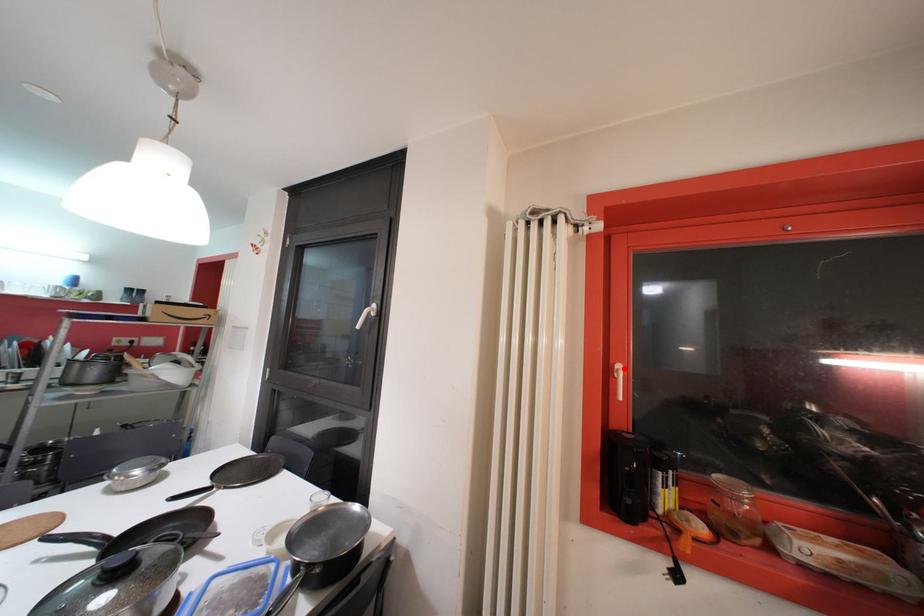
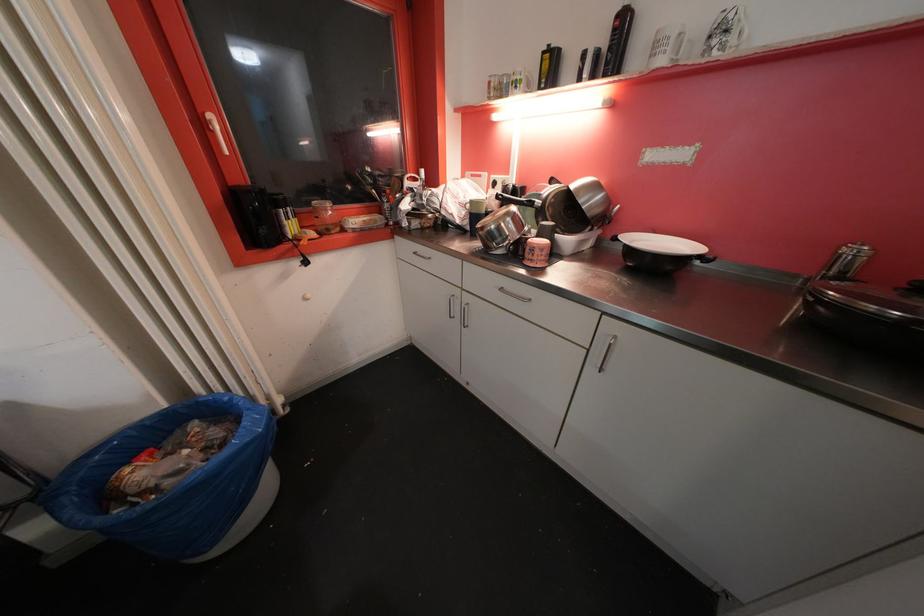
Find the pixel in the second image that matches the highlighted location in the first image.

(215, 119)